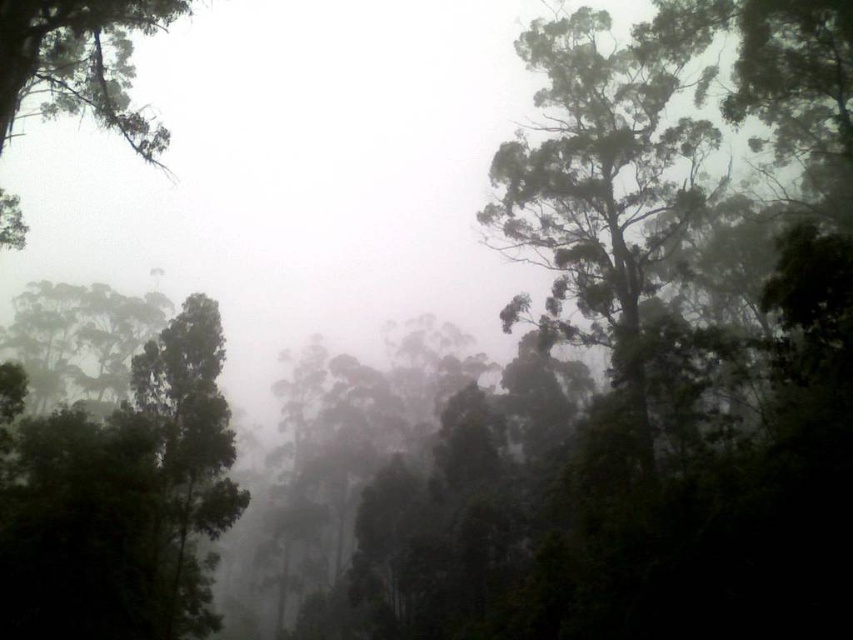
Question: Is green matte tree at left closer to the viewer compared to green matte tree at upper left?

Choices:
 (A) yes
 (B) no

Answer: (B)

Question: Which object is positioned closest to the green matte tree at upper left?

Choices:
 (A) green leafy tree at upper right
 (B) green matte tree at left

Answer: (B)

Question: Estimate the real-world distances between objects in this image. Which object is farther from the green matte tree at left?

Choices:
 (A) green matte tree at upper left
 (B) green leafy tree at upper right

Answer: (A)

Question: Which point is farther from the camera taking this photo?

Choices:
 (A) (210, 337)
 (B) (128, 74)
 (C) (672, 131)

Answer: (B)

Question: Can you confirm if green matte tree at left is thinner than green matte tree at upper left?

Choices:
 (A) no
 (B) yes

Answer: (B)

Question: Is green leafy tree at upper right below green matte tree at upper left?

Choices:
 (A) yes
 (B) no

Answer: (A)